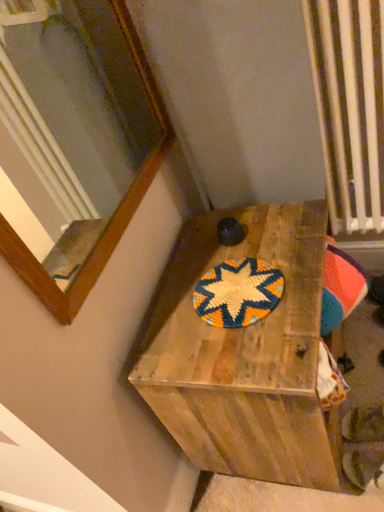
Question: Does wooden box at center have a lesser height compared to wooden frame at upper left?

Choices:
 (A) no
 (B) yes

Answer: (A)

Question: From the image's perspective, does wooden box at center appear higher than wooden frame at upper left?

Choices:
 (A) yes
 (B) no

Answer: (B)

Question: Is the depth of wooden box at center less than that of wooden frame at upper left?

Choices:
 (A) no
 (B) yes

Answer: (A)

Question: Is there a large distance between wooden box at center and wooden frame at upper left?

Choices:
 (A) no
 (B) yes

Answer: (A)

Question: From the image's perspective, does wooden box at center appear lower than wooden frame at upper left?

Choices:
 (A) yes
 (B) no

Answer: (A)

Question: Can you confirm if wooden box at center is thinner than wooden frame at upper left?

Choices:
 (A) no
 (B) yes

Answer: (A)

Question: Does brightly woven mat at center have a larger size compared to wooden box at center?

Choices:
 (A) no
 (B) yes

Answer: (A)

Question: Does brightly woven mat at center appear on the left side of wooden box at center?

Choices:
 (A) yes
 (B) no

Answer: (A)

Question: Considering the relative sizes of brightly woven mat at center and wooden box at center in the image provided, is brightly woven mat at center wider than wooden box at center?

Choices:
 (A) yes
 (B) no

Answer: (B)

Question: Does brightly woven mat at center turn towards wooden box at center?

Choices:
 (A) no
 (B) yes

Answer: (B)

Question: Can you confirm if brightly woven mat at center is shorter than wooden box at center?

Choices:
 (A) yes
 (B) no

Answer: (A)

Question: Is brightly woven mat at center turned away from wooden box at center?

Choices:
 (A) no
 (B) yes

Answer: (B)

Question: Is wooden box at center shorter than brightly woven mat at center?

Choices:
 (A) yes
 (B) no

Answer: (B)